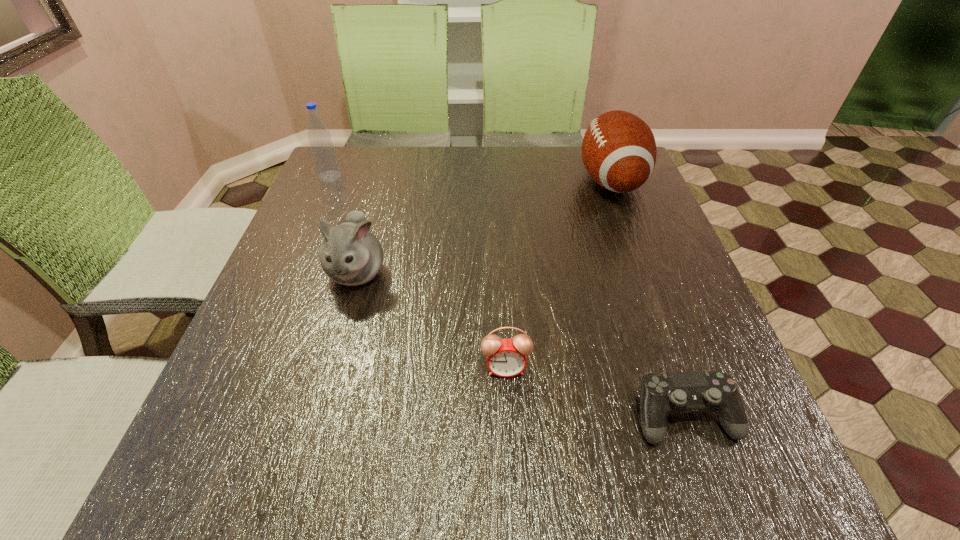
Where is `football that is at the right edge`? football that is at the right edge is located at coordinates (619, 151).

This screenshot has width=960, height=540. What are the coordinates of `control that is at the right edge` in the screenshot? It's located at (661, 394).

Locate an element on the screen. This screenshot has height=540, width=960. object that is at the far left corner is located at coordinates click(323, 152).

Locate an element on the screen. The image size is (960, 540). object that is at the far right corner is located at coordinates (619, 151).

Locate an element on the screen. Image resolution: width=960 pixels, height=540 pixels. object that is at the near right corner is located at coordinates (661, 394).

The height and width of the screenshot is (540, 960). In the image, there is a desktop. In order to click on vacant area at the far edge in this screenshot , I will do `click(470, 171)`.

You are a GUI agent. You are given a task and a screenshot of the screen. Output one action in this format:
    pyautogui.click(x=<x>, y=<y>)
    Task: Click on the free location at the near edge
    This screenshot has height=540, width=960.
    Given the screenshot: What is the action you would take?
    pyautogui.click(x=572, y=458)

At what (x,y) coordinates should I click in order to perform the action: click on vacant space at the left edge. Please return your answer as a coordinate pair (x, y). The height and width of the screenshot is (540, 960). Looking at the image, I should click on (284, 322).

At what (x,y) coordinates should I click in order to perform the action: click on vacant region at the right edge of the desktop. Please return your answer as a coordinate pair (x, y). The height and width of the screenshot is (540, 960). Looking at the image, I should click on (640, 272).

I want to click on vacant point at the near right corner, so click(x=756, y=505).